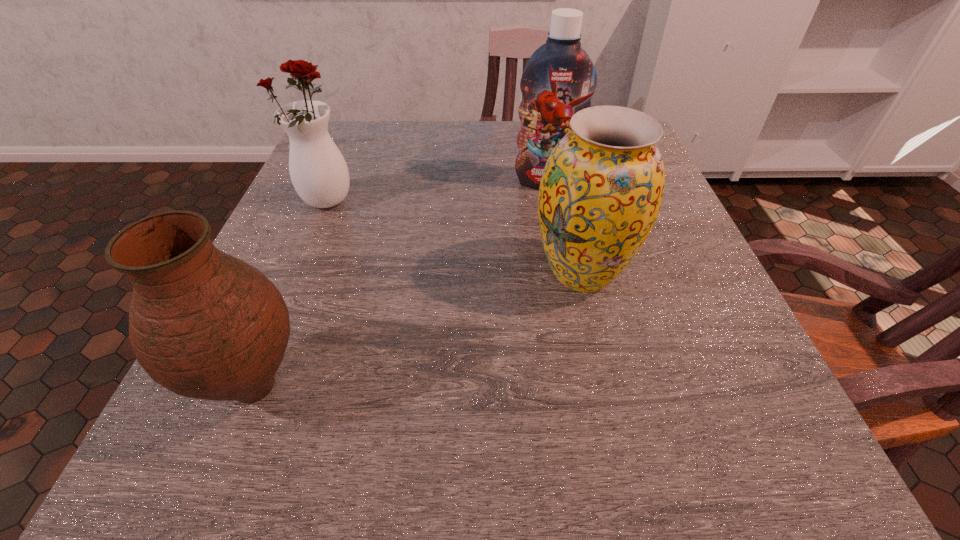
Find the location of `object that is at the right edge`. object that is at the right edge is located at coordinates (601, 190).

Locate an element on the screen. The height and width of the screenshot is (540, 960). object located in the near left corner section of the desktop is located at coordinates (203, 324).

Locate an element on the screen. The height and width of the screenshot is (540, 960). free location at the far edge of the desktop is located at coordinates (425, 126).

Find the location of a particular element. The width and height of the screenshot is (960, 540). vacant position at the near edge of the desktop is located at coordinates (509, 435).

The image size is (960, 540). Find the location of `vacant space at the left edge of the desktop`. vacant space at the left edge of the desktop is located at coordinates (311, 276).

At what (x,y) coordinates should I click in order to perform the action: click on vacant space at the right edge of the desktop. Please return your answer as a coordinate pair (x, y). This screenshot has height=540, width=960. Looking at the image, I should click on (660, 379).

This screenshot has width=960, height=540. I want to click on vacant space at the far left corner, so click(368, 162).

The image size is (960, 540). Identify the location of empty location between the second farthest vase and the farthest vase. (454, 239).

The width and height of the screenshot is (960, 540). In order to click on free point between the nearest vase and the farthest vase in this screenshot , I will do `click(291, 295)`.

The height and width of the screenshot is (540, 960). Identify the location of free space between the nearest object and the shampoo. (400, 284).